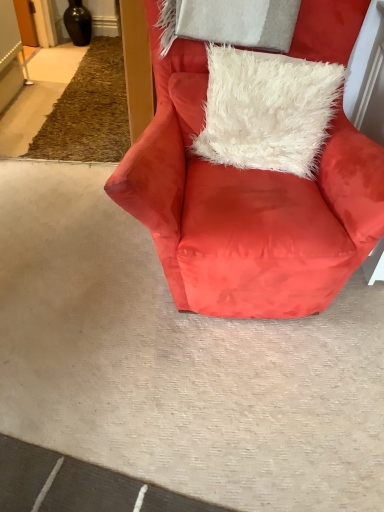
Question: From a real-world perspective, is satin red armchair at center positioned under white fluffy pillow at center based on gravity?

Choices:
 (A) yes
 (B) no

Answer: (A)

Question: Could you tell me if satin red armchair at center is facing white fluffy pillow at center?

Choices:
 (A) yes
 (B) no

Answer: (A)

Question: Would you say satin red armchair at center is outside white fluffy pillow at center?

Choices:
 (A) no
 (B) yes

Answer: (B)

Question: Is the position of satin red armchair at center more distant than that of white fluffy pillow at center?

Choices:
 (A) yes
 (B) no

Answer: (B)

Question: Considering the relative positions of satin red armchair at center and white fluffy pillow at center in the image provided, is satin red armchair at center in front of white fluffy pillow at center?

Choices:
 (A) yes
 (B) no

Answer: (A)

Question: From the image's perspective, is satin red armchair at center under white fluffy pillow at center?

Choices:
 (A) yes
 (B) no

Answer: (A)

Question: From a real-world perspective, is white fluffy pillow at center positioned under satin red armchair at center based on gravity?

Choices:
 (A) yes
 (B) no

Answer: (B)

Question: From the image's perspective, is white fluffy pillow at center located beneath satin red armchair at center?

Choices:
 (A) yes
 (B) no

Answer: (B)

Question: Is white fluffy pillow at center wider than satin red armchair at center?

Choices:
 (A) yes
 (B) no

Answer: (B)

Question: Is white fluffy pillow at center closer to camera compared to satin red armchair at center?

Choices:
 (A) yes
 (B) no

Answer: (B)

Question: Can you confirm if white fluffy pillow at center is smaller than satin red armchair at center?

Choices:
 (A) no
 (B) yes

Answer: (B)

Question: From the image's perspective, is white fluffy pillow at center located above satin red armchair at center?

Choices:
 (A) yes
 (B) no

Answer: (A)

Question: Is white fluffy pillow at center taller or shorter than satin red armchair at center?

Choices:
 (A) tall
 (B) short

Answer: (B)